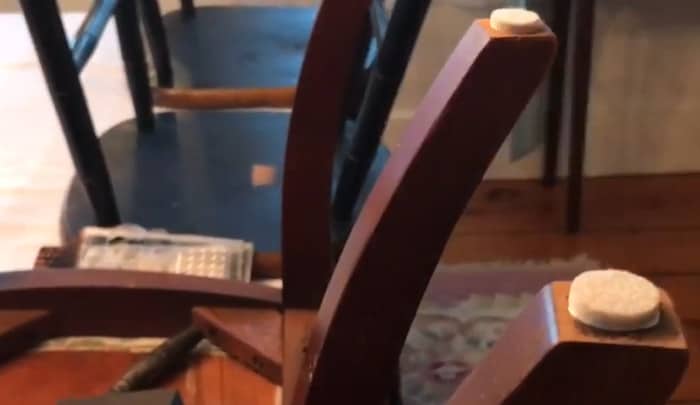
Find the location of `black chair leg`. black chair leg is located at coordinates (76, 106), (138, 60), (160, 42), (190, 4), (382, 91).